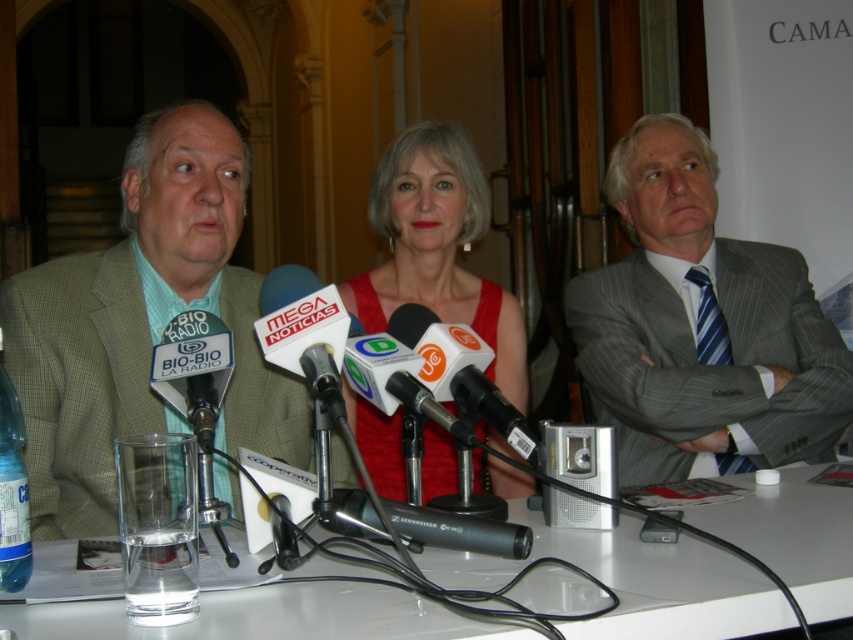
Based on the coordinates provided, which individual is located at the point with the coordinates [140,324] in the press conference scene?

The point with coordinates [140,324] corresponds to the green checkered suit at left.